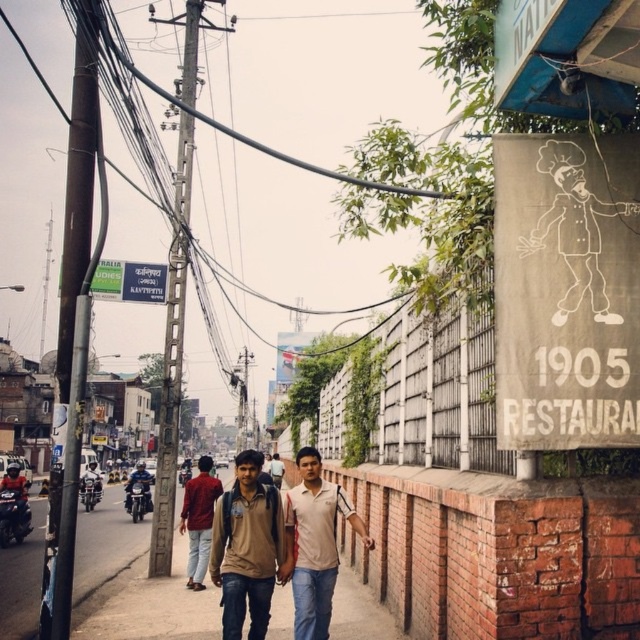
Does light beige cotton shirt at center lie in front of blue plastic signboard at upper left?

Yes, light beige cotton shirt at center is in front of blue plastic signboard at upper left.

Does light beige cotton shirt at center appear on the left side of blue plastic signboard at upper left?

Incorrect, light beige cotton shirt at center is not on the left side of blue plastic signboard at upper left.

Who is more distant from viewer, (289, 540) or (92, 296)?

The point (92, 296) is behind.

The width and height of the screenshot is (640, 640). In order to click on light beige cotton shirt at center in this screenshot , I will do `click(314, 545)`.

Is light brown cotton shirt at center shorter than blue plastic signboard at upper left?

No.

Looking at this image, between light brown cotton shirt at center and blue plastic signboard at upper left, which one is positioned higher?

blue plastic signboard at upper left is higher up.

The width and height of the screenshot is (640, 640). I want to click on light brown cotton shirt at center, so click(x=248, y=548).

Is light beige cotton shirt at center shorter than shiny blue motorcycle at center?

Yes, light beige cotton shirt at center is shorter than shiny blue motorcycle at center.

Looking at this image, does light beige cotton shirt at center have a lesser width compared to shiny blue motorcycle at center?

Correct, light beige cotton shirt at center's width is less than shiny blue motorcycle at center's.

This screenshot has width=640, height=640. What are the coordinates of `light beige cotton shirt at center` in the screenshot? It's located at (314, 545).